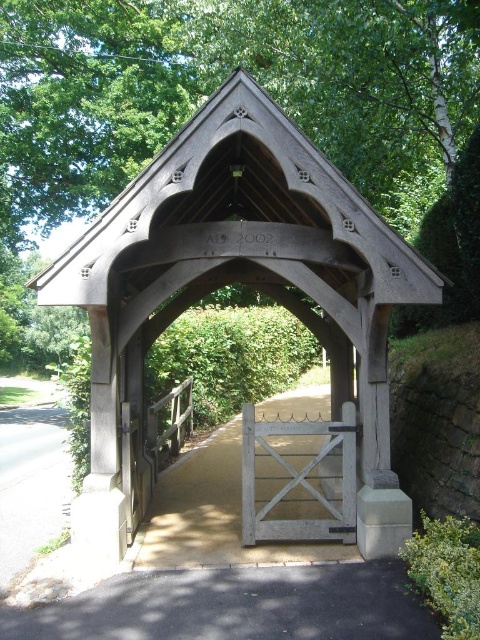
Question: Does wooden gazebo at center come behind white wooden gate at center?

Choices:
 (A) yes
 (B) no

Answer: (B)

Question: Which point appears farthest from the camera in this image?

Choices:
 (A) (227, 552)
 (B) (394, 502)

Answer: (A)

Question: Can you confirm if wooden gazebo at center is bigger than white wooden gate at center?

Choices:
 (A) no
 (B) yes

Answer: (B)

Question: Which point is farther to the camera?

Choices:
 (A) wooden gazebo at center
 (B) white wooden gate at center

Answer: (B)

Question: Is wooden gazebo at center thinner than white wooden gate at center?

Choices:
 (A) yes
 (B) no

Answer: (B)